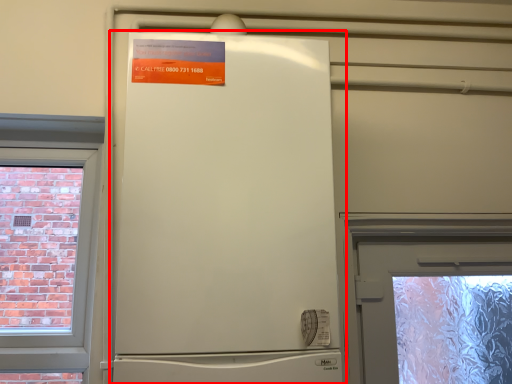
Question: Observing the image, what is the correct spatial positioning of refrigerator (annotated by the red box) in reference to poster?

Choices:
 (A) right
 (B) left

Answer: (A)